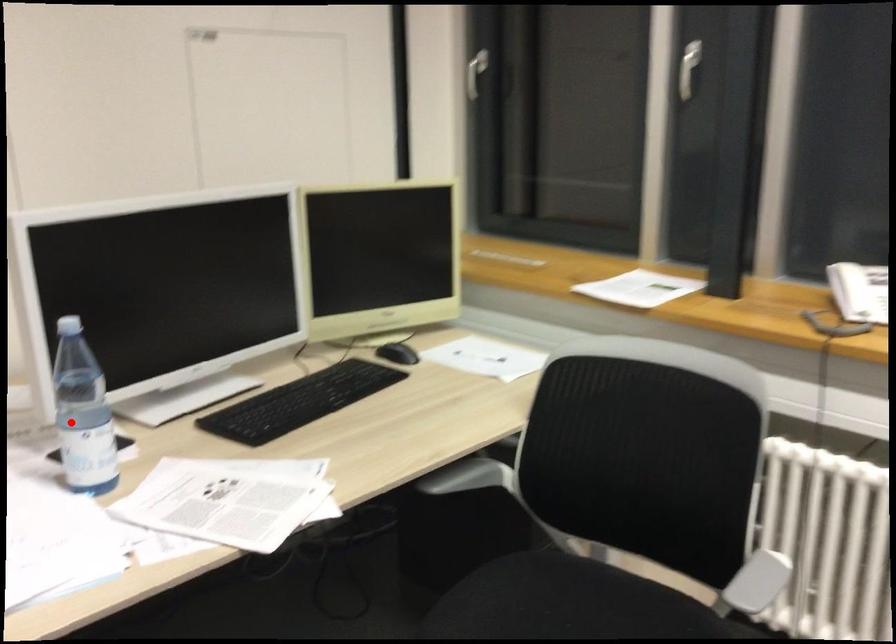
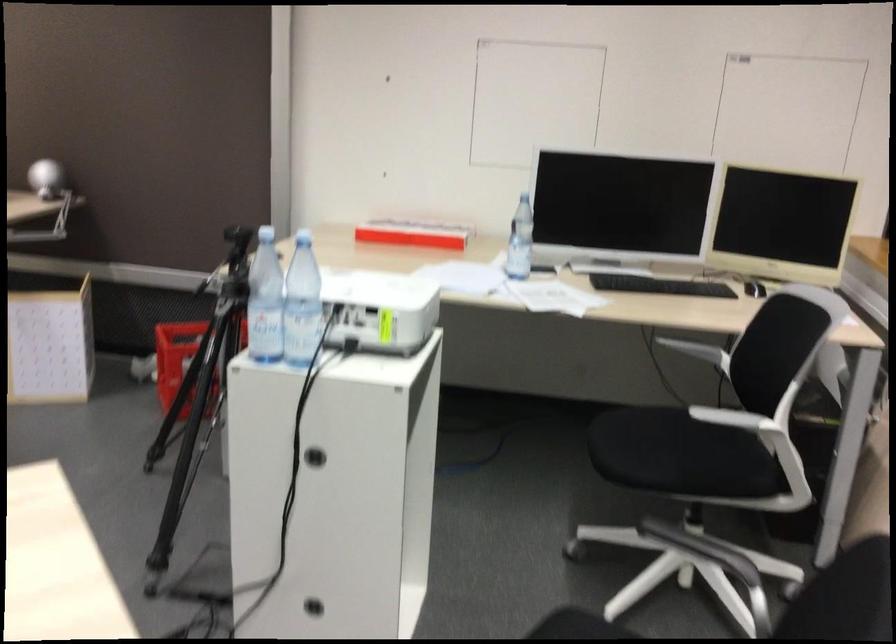
Question: I am providing you with two images of the same scene from different viewpoints. In image1, a red point is highlighted. Considering the same 3D point in image2, which of the following is correct?

Choices:
 (A) It is closer
 (B) It is farther

Answer: (B)